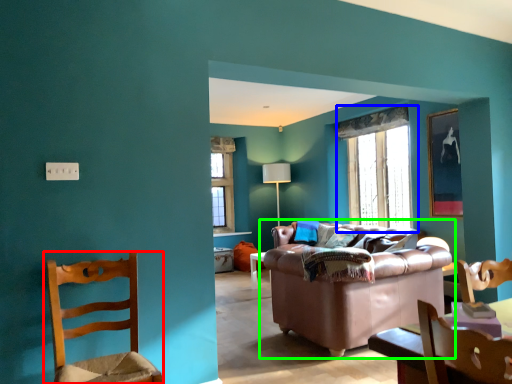
Question: Which object is the farthest from chair (highlighted by a red box)? Choose among these: window (highlighted by a blue box) or studio couch (highlighted by a green box).

Choices:
 (A) window
 (B) studio couch

Answer: (A)